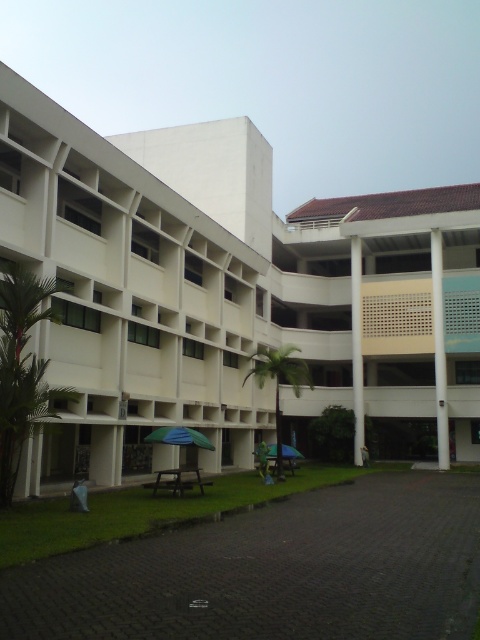
Question: From the image, what is the correct spatial relationship of white smooth building at center in relation to green fabric umbrella at lower center?

Choices:
 (A) left
 (B) right

Answer: (B)

Question: Which object is closer to the camera taking this photo?

Choices:
 (A) green fabric umbrella at lower center
 (B) white smooth building at center

Answer: (B)

Question: Which point is farther from the camera taking this photo?

Choices:
 (A) (455, 308)
 (B) (156, 433)

Answer: (A)

Question: Can you confirm if white smooth building at center is positioned above green fabric umbrella at lower center?

Choices:
 (A) yes
 (B) no

Answer: (A)

Question: Which of the following is the farthest from the observer?

Choices:
 (A) white smooth building at center
 (B) green fabric umbrella at lower center

Answer: (B)

Question: Is white smooth building at center further to the viewer compared to green fabric umbrella at lower center?

Choices:
 (A) no
 (B) yes

Answer: (A)